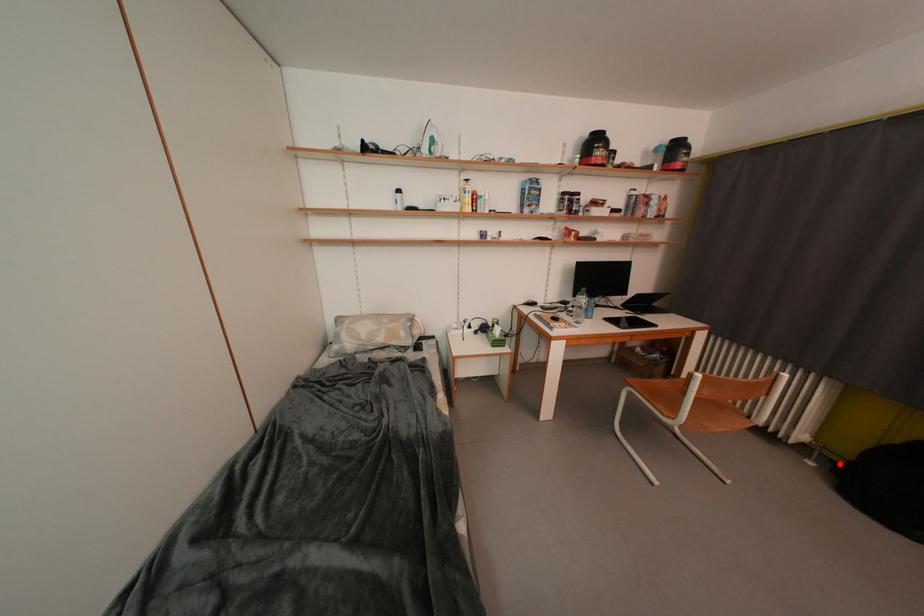
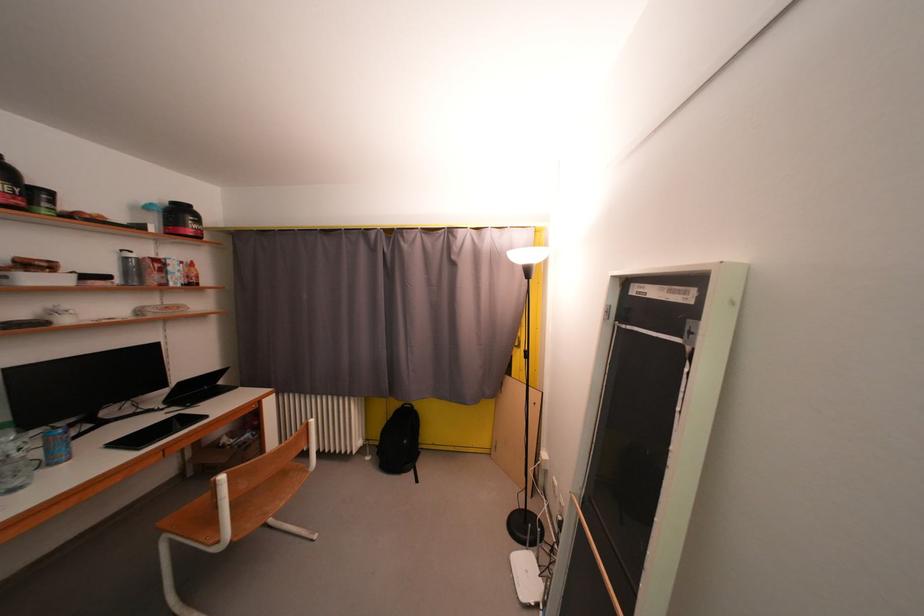
Question: I am providing you with two images of the same scene from different viewpoints. A red point is shown in image1. For the corresponding object point in image2, is it positioned nearer or farther from the camera?

Choices:
 (A) Nearer
 (B) Farther

Answer: (B)